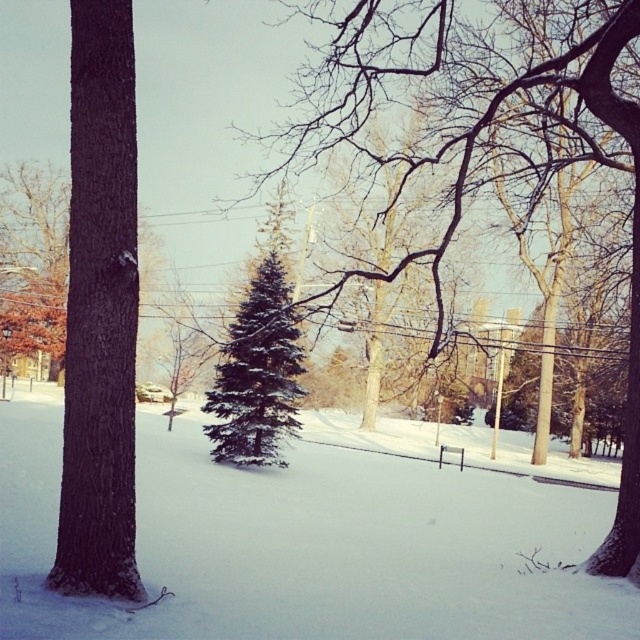
You are a park ranger planning to place a new bench between the brown rough bark tree at left and the green matte evergreen tree at center. The bench requires a minimum of 10 meters of space between the two trees to be placed safely. Can you place the bench there?

The distance between the brown rough bark tree at left and the green matte evergreen tree at center is 13.77 meters, which is more than the required 10 meters. Therefore, the bench can be placed there safely.